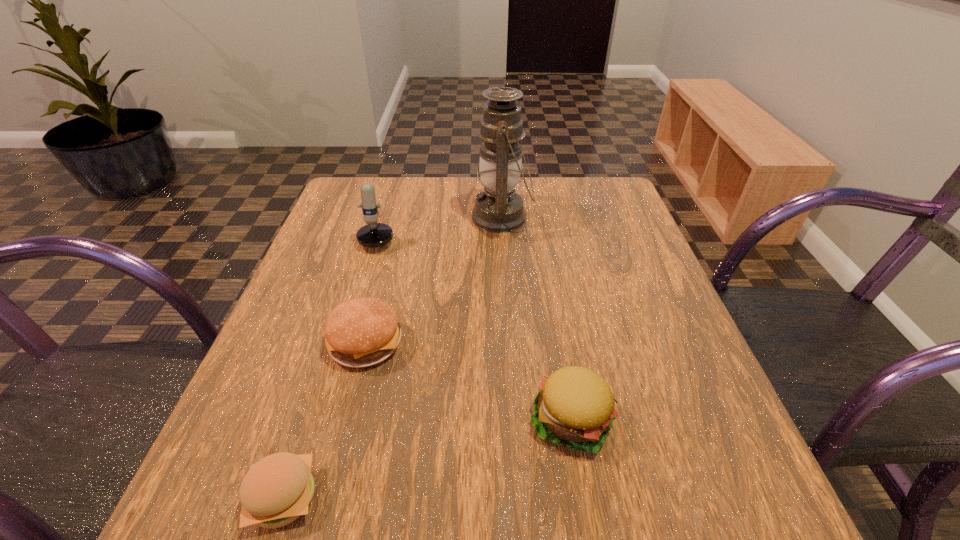
Locate an element on the screen. This screenshot has width=960, height=540. oil lamp is located at coordinates (498, 209).

Where is `microphone`? The image size is (960, 540). microphone is located at coordinates (372, 235).

Find the location of a particular element. This screenshot has height=540, width=960. the second nearest object is located at coordinates (575, 406).

Locate an element on the screen. the second nearest hamburger is located at coordinates (575, 406).

Image resolution: width=960 pixels, height=540 pixels. I want to click on the farthest hamburger, so click(x=361, y=332).

Locate an element on the screen. This screenshot has height=540, width=960. the nearest hamburger is located at coordinates (278, 489).

In order to click on vacant space positioned on the left of the oil lamp in this screenshot , I will do `click(444, 218)`.

Locate an element on the screen. vacant position located on the right of the microphone is located at coordinates (477, 230).

You are a GUI agent. You are given a task and a screenshot of the screen. Output one action in this format:
    pyautogui.click(x=<x>, y=<y>)
    Task: Click on the free space located on the left of the rightmost hamburger
    This screenshot has width=960, height=540.
    Given the screenshot: What is the action you would take?
    pyautogui.click(x=444, y=420)

What are the coordinates of `blank space located 0.300m on the right of the third farthest object` in the screenshot? It's located at (568, 342).